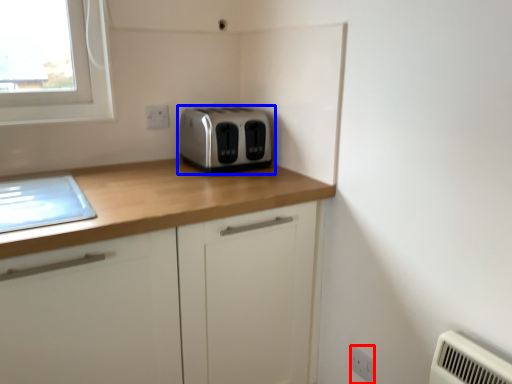
Question: Which object is closer to the camera taking this photo, electric outlet (highlighted by a red box) or toaster (highlighted by a blue box)?

Choices:
 (A) electric outlet
 (B) toaster

Answer: (A)